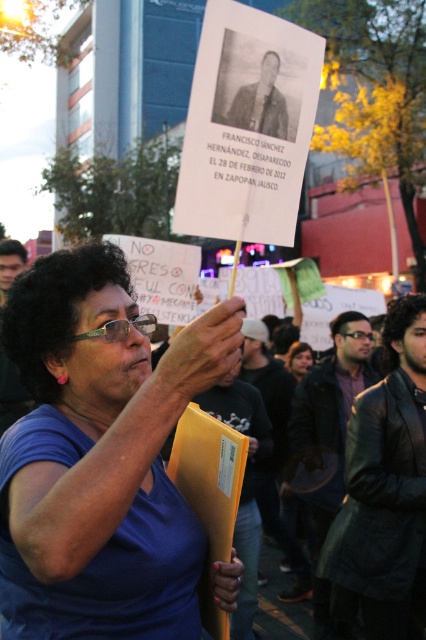
Question: Considering the relative positions of blue fabric shirt at center and black leather jacket at center in the image provided, where is blue fabric shirt at center located with respect to black leather jacket at center?

Choices:
 (A) right
 (B) left

Answer: (B)

Question: Which of the following is the closest to the observer?

Choices:
 (A) (348, 339)
 (B) (294, 356)
 (C) (406, 596)
 (D) (242, 611)

Answer: (C)

Question: Which of these objects is positioned closest to the blue fabric shirt at center?

Choices:
 (A) black leather jacket at center
 (B) yellow paper folder at center
 (C) leather jacket at center
 (D) dark brown leather jacket at center

Answer: (C)

Question: Which point appears closest to the camera in this image?

Choices:
 (A) (391, 440)
 (B) (288, 362)
 (C) (249, 572)
 (D) (273, 432)

Answer: (A)

Question: Is dark brown leather jacket at center below yellow paper folder at center?

Choices:
 (A) no
 (B) yes

Answer: (A)

Question: In this image, where is black leather jacket at center located relative to blonde hair at center?

Choices:
 (A) left
 (B) right

Answer: (A)